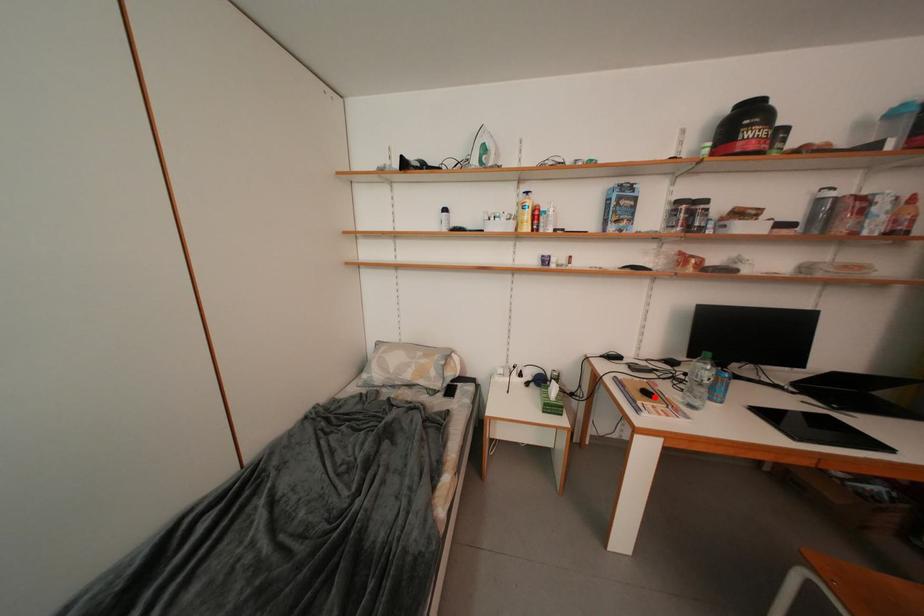
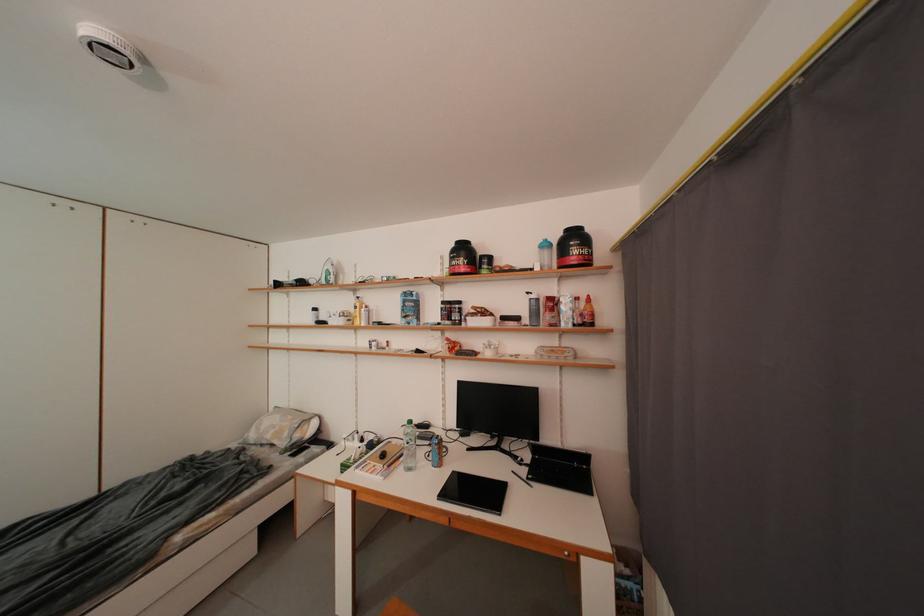
Where in the second image is the point corresponding to the highlighted location from the first image?

(391, 459)